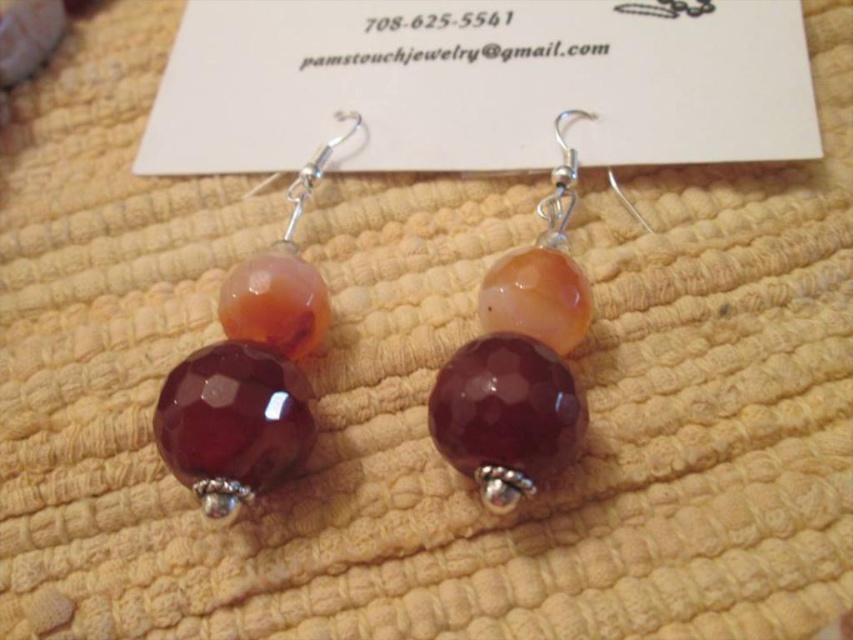
Question: Is faceted glass bead at left in front of ruby glass bead at center?

Choices:
 (A) yes
 (B) no

Answer: (B)

Question: Among these points, which one is nearest to the camera?

Choices:
 (A) (276, 272)
 (B) (515, 269)
 (C) (432, 436)

Answer: (C)

Question: Can you confirm if matte orange bead at center is positioned below faceted purple glass bead at center?

Choices:
 (A) yes
 (B) no

Answer: (B)

Question: Can you confirm if faceted glass bead at left is thinner than ruby glass bead at center?

Choices:
 (A) yes
 (B) no

Answer: (B)

Question: Estimate the real-world distances between objects in this image. Which object is closer to the faceted glass bead at left?

Choices:
 (A) ruby glass bead at center
 (B) faceted purple glass bead at center

Answer: (A)

Question: Which point is closer to the camera?

Choices:
 (A) faceted purple glass bead at center
 (B) faceted glass bead at left
 (C) matte orange bead at center
 (D) ruby glass bead at center

Answer: (D)